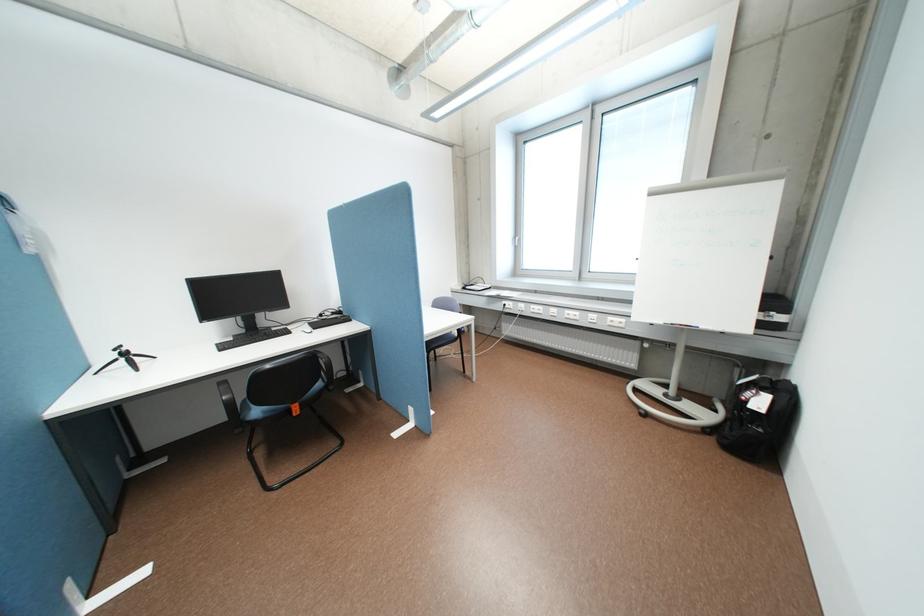
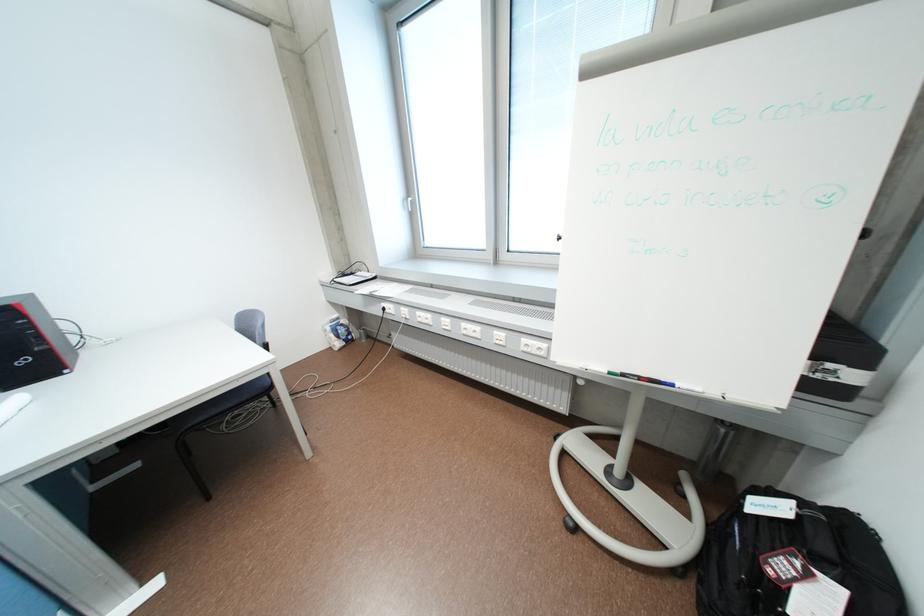
What movement of the cameraman would produce the second image?

The cameraman walked toward right, forward.